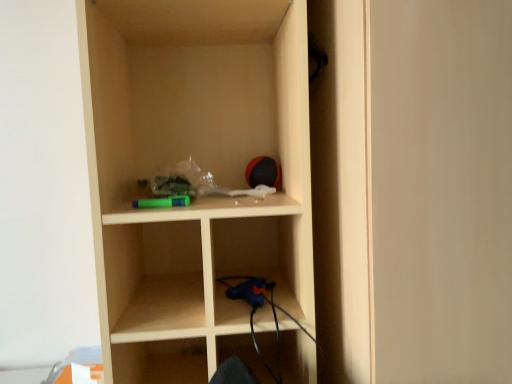
What do you see at coordinates (441, 190) in the screenshot? The width and height of the screenshot is (512, 384). I see `matte wood door at center` at bounding box center [441, 190].

You are a GUI agent. You are given a task and a screenshot of the screen. Output one action in this format:
    pyautogui.click(x=<x>, y=<y>)
    Task: Click on the matte wood door at center
    
    Given the screenshot: What is the action you would take?
    pyautogui.click(x=441, y=190)

This screenshot has height=384, width=512. What do you see at coordinates (228, 178) in the screenshot?
I see `matte wood shelf at center` at bounding box center [228, 178].

What is the approximate width of matte wood shelf at center?

matte wood shelf at center is 16.19 inches wide.

Find the location of a particular element. The height and width of the screenshot is (384, 512). matte wood shelf at center is located at coordinates (228, 178).

Where is `matte wood door at center`? matte wood door at center is located at coordinates (441, 190).

Looking at this image, in the image, is matte wood shelf at center on the left side or the right side of matte wood door at center?

Based on their positions, matte wood shelf at center is located to the left of matte wood door at center.

Based on the photo, is the depth of matte wood shelf at center greater than that of matte wood door at center?

Yes, matte wood shelf at center is behind matte wood door at center.

Considering the points (106, 298) and (474, 73), which point is behind, point (106, 298) or point (474, 73)?

The point (106, 298) is farther.

From the image's perspective, would you say matte wood shelf at center is shown under matte wood door at center?

No.

From a real-world perspective, is matte wood shelf at center over matte wood door at center?

Yes.

From the picture: Can you confirm if matte wood shelf at center is thinner than matte wood door at center?

Yes, matte wood shelf at center is thinner than matte wood door at center.

Between matte wood shelf at center and matte wood door at center, which one has less height?

With less height is matte wood shelf at center.

Based on the photo, considering the sizes of objects matte wood shelf at center and matte wood door at center in the image provided, who is smaller, matte wood shelf at center or matte wood door at center?

Smaller between the two is matte wood shelf at center.

Would you say matte wood door at center is part of matte wood shelf at center's contents?

No, matte wood shelf at center does not contain matte wood door at center.

Are matte wood shelf at center and matte wood door at center making contact?

They are not placed beside each other.

Is matte wood shelf at center facing towards matte wood door at center?

No.

The width and height of the screenshot is (512, 384). I want to click on shelf above the matte wood door at center (from a real-world perspective), so click(228, 178).

Can you confirm if matte wood door at center is positioned to the left of matte wood shelf at center?

In fact, matte wood door at center is to the right of matte wood shelf at center.

In the image, is matte wood door at center positioned in front of or behind matte wood shelf at center?

Clearly, matte wood door at center is in front of matte wood shelf at center.

Is point (477, 381) positioned behind point (294, 39)?

No, (477, 381) is closer to viewer.

From the image's perspective, which one is positioned lower, matte wood door at center or matte wood shelf at center?

matte wood door at center appears lower in the image.

From a real-world perspective, does matte wood door at center stand above matte wood shelf at center?

No, from a real-world perspective, matte wood door at center is not over matte wood shelf at center

Considering the relative sizes of matte wood door at center and matte wood shelf at center in the image provided, is matte wood door at center wider than matte wood shelf at center?

Correct, the width of matte wood door at center exceeds that of matte wood shelf at center.

Does matte wood door at center have a lesser height compared to matte wood shelf at center?

In fact, matte wood door at center may be taller than matte wood shelf at center.

Looking at the image, does matte wood door at center seem bigger or smaller compared to matte wood shelf at center?

In the image, matte wood door at center appears to be larger than matte wood shelf at center.

Choose the correct answer: Is matte wood door at center inside matte wood shelf at center or outside it?

matte wood door at center is located beyond the bounds of matte wood shelf at center.

Is matte wood door at center beside matte wood shelf at center?

matte wood door at center is not next to matte wood shelf at center, and they're not touching.

Is matte wood door at center facing away from matte wood shelf at center?

No, matte wood door at center is not facing away from matte wood shelf at center.

Based on the photo, can you tell me how much matte wood door at center and matte wood shelf at center differ in facing direction?

0.521 degrees.

Measure the distance from matte wood door at center to matte wood shelf at center.

A distance of 12.76 inches exists between matte wood door at center and matte wood shelf at center.

Image resolution: width=512 pixels, height=384 pixels. I want to click on shelf that is on the left side of matte wood door at center, so click(228, 178).

You are a GUI agent. You are given a task and a screenshot of the screen. Output one action in this format:
    pyautogui.click(x=<x>, y=<y>)
    Task: Click on the shelf that appears behind the matte wood door at center
    The width and height of the screenshot is (512, 384).
    Given the screenshot: What is the action you would take?
    pyautogui.click(x=228, y=178)

Locate an element on the screen. This screenshot has height=384, width=512. shelf on the left of the matte wood door at center is located at coordinates (228, 178).